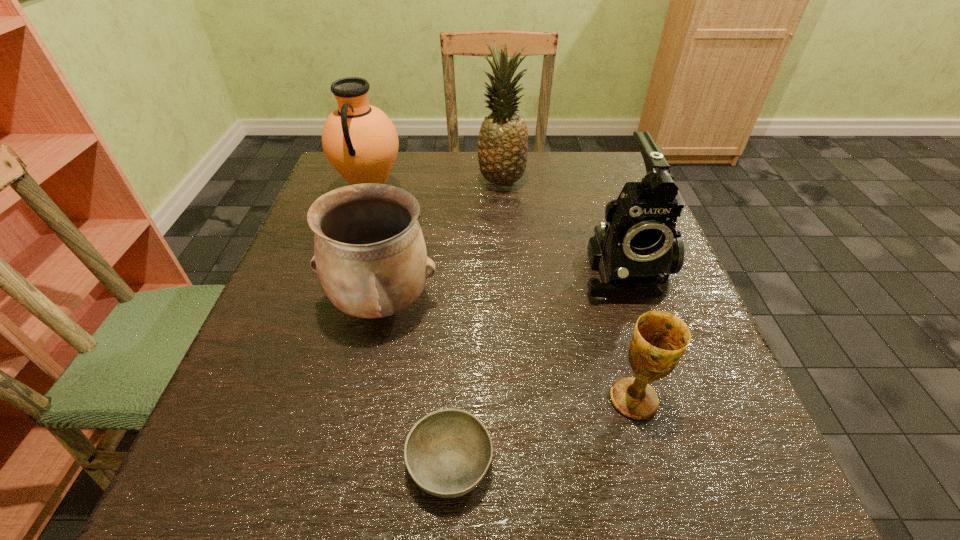
At what (x,y) coordinates should I click in order to perform the action: click on chalice at the right edge. Please return your answer as a coordinate pair (x, y). The height and width of the screenshot is (540, 960). Looking at the image, I should click on (659, 340).

At what (x,y) coordinates should I click in order to perform the action: click on object that is at the far left corner. Please return your answer as a coordinate pair (x, y). Looking at the image, I should click on (360, 141).

Locate an element on the screen. This screenshot has width=960, height=540. free region at the far edge of the desktop is located at coordinates (458, 178).

I want to click on free point at the near edge, so click(x=362, y=510).

Locate an element on the screen. The width and height of the screenshot is (960, 540). free space at the left edge of the desktop is located at coordinates (294, 364).

The height and width of the screenshot is (540, 960). Find the location of `free space at the right edge of the desktop`. free space at the right edge of the desktop is located at coordinates (736, 455).

The height and width of the screenshot is (540, 960). I want to click on free spot at the far left corner of the desktop, so click(x=327, y=174).

This screenshot has height=540, width=960. I want to click on vacant space at the far right corner of the desktop, so click(607, 197).

Where is `vacant area between the pitcher and the shortest object`? Image resolution: width=960 pixels, height=540 pixels. vacant area between the pitcher and the shortest object is located at coordinates (411, 330).

Identify the location of free space between the pitcher and the second nearest object. point(502,298).